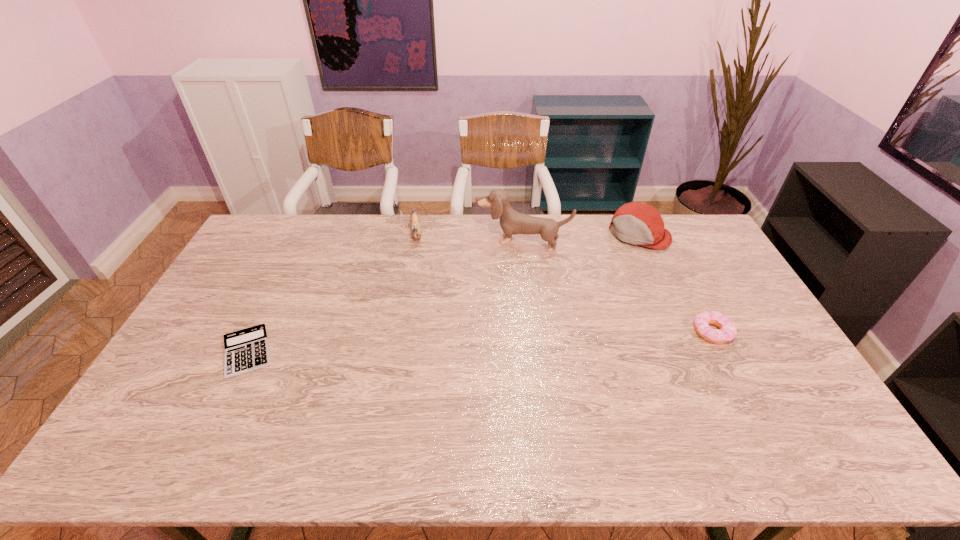
The width and height of the screenshot is (960, 540). Find the location of `vacant space on the desktop that is between the leftmost object and the second shortest object and is positioned at the face of the puppy`. vacant space on the desktop that is between the leftmost object and the second shortest object and is positioned at the face of the puppy is located at coordinates (486, 342).

Where is `vacant space on the desktop that is between the calculator and the doughnut and is positioned on the front-facing side of the cap`? vacant space on the desktop that is between the calculator and the doughnut and is positioned on the front-facing side of the cap is located at coordinates (550, 339).

The image size is (960, 540). In order to click on vacant space on the desktop that is between the shortest object and the second shortest object and is positioned on the peel of the fourth object from right to left in this screenshot , I will do `click(427, 345)`.